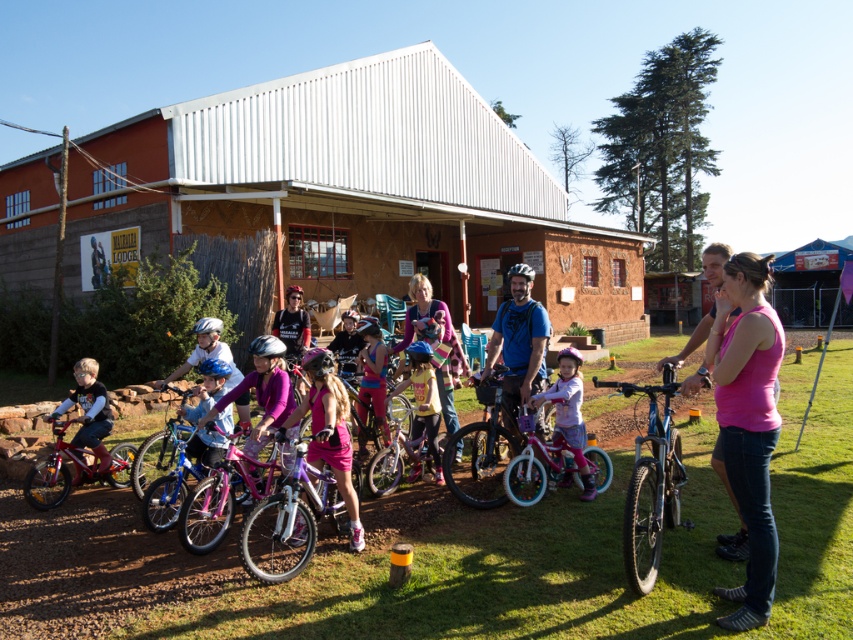
You are a photographer standing at the back of the scene. You want to take a photo of the pink matte bicycle at center and the matte black shirt at left. Which object will appear closer to the camera in the photo?

The pink matte bicycle at center will appear closer to the camera in the photo because it is positioned in front of the matte black shirt at left.

You are organizing a bike race for children at Matjiesfontein Lodge. You have two bikes available for the race track, the shiny pink bicycle at center and the shiny red bicycle at left. Which bike would require less space to maneuver in the race track?

The shiny pink bicycle at center occupies less space than the shiny red bicycle at left, so it would require less space to maneuver in the race track.